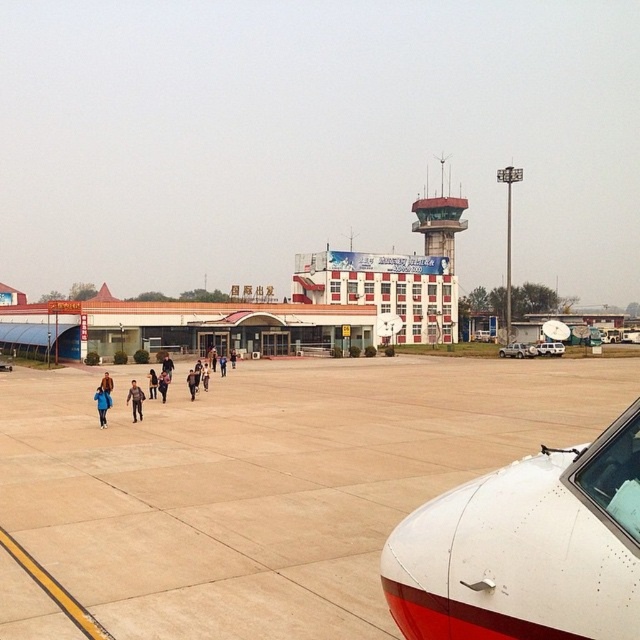
Between dark gray jacket at center and blue fabric person at center, which one has less height?

Standing shorter between the two is blue fabric person at center.

Which is behind, point (131, 394) or point (164, 378)?

The point (164, 378) is more distant.

Find the location of a particular element. This screenshot has width=640, height=640. dark gray jacket at center is located at coordinates coord(134,401).

Does white matte airplane at lower right have a lesser height compared to blue fabric jacket at lower left?

Correct, white matte airplane at lower right is not as tall as blue fabric jacket at lower left.

Identify the location of white matte airplane at lower right. This screenshot has height=640, width=640. (525, 548).

Where is `white matte airplane at lower right`? white matte airplane at lower right is located at coordinates (525, 548).

Consider the image. Between matte red control tower at center and blue matte jacket at lower left, which one appears on the right side from the viewer's perspective?

matte red control tower at center

Does matte red control tower at center appear under blue matte jacket at lower left?

Incorrect, matte red control tower at center is not positioned below blue matte jacket at lower left.

Is point (451, 230) positioned behind point (104, 406)?

Yes, point (451, 230) is behind point (104, 406).

The image size is (640, 640). I want to click on matte red control tower at center, so click(x=440, y=220).